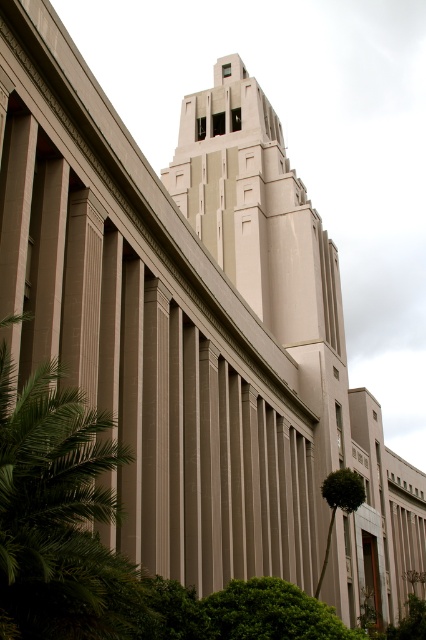
Does point (9, 538) come in front of point (342, 476)?

Yes, it is.

Consider the image. Which is more to the left, green leafy palm tree at left or green leafy palm tree at lower right?

green leafy palm tree at left is more to the left.

Measure the distance between point [75,624] and camera.

Point [75,624] and camera are 60.09 feet apart.

The width and height of the screenshot is (426, 640). In order to click on green leafy palm tree at left in this screenshot , I will do `click(57, 516)`.